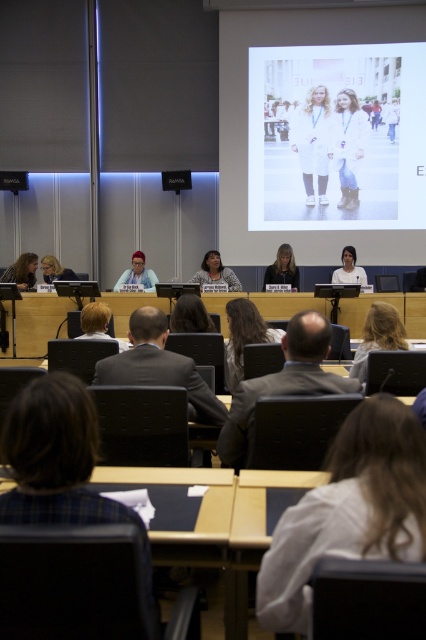
Question: Can you confirm if white fabric at upper center is positioned above white matte coat at center?

Choices:
 (A) no
 (B) yes

Answer: (B)

Question: Does matte black hair at lower left appear over white fabric shirt at center?

Choices:
 (A) no
 (B) yes

Answer: (A)

Question: Based on their relative distances, which object is nearer to the matte black hair at lower left?

Choices:
 (A) dark brown hair at center
 (B) matte black laptop at left
 (C) white fabric at upper center

Answer: (B)

Question: Which point is closer to the camera?

Choices:
 (A) (287, 180)
 (B) (336, 109)
 (C) (342, 276)

Answer: (C)

Question: Which point is farther from the camera taking this photo?

Choices:
 (A) (25, 285)
 (B) (132, 259)
 (C) (402, 68)
 (D) (290, 285)

Answer: (B)

Question: Can you confirm if white leather boots at center is positioned to the right of matte black laptop at left?

Choices:
 (A) no
 (B) yes

Answer: (B)